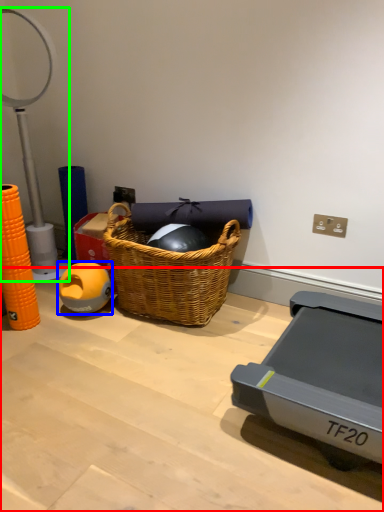
Question: Estimate the real-world distances between objects in this image. Which object is farther from table (highlighted by a red box), ball (highlighted by a blue box) or table lamp (highlighted by a green box)?

Choices:
 (A) ball
 (B) table lamp

Answer: (B)